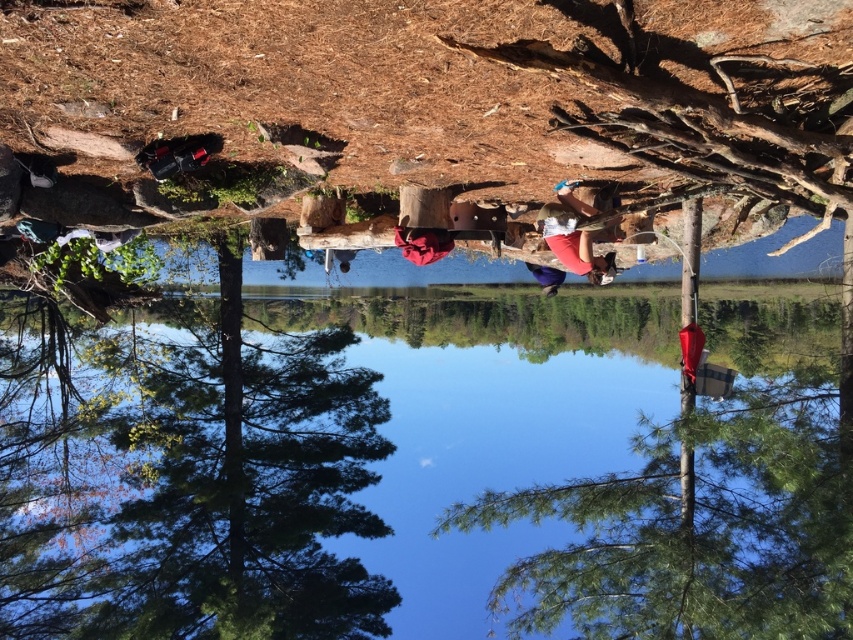
Question: Which object is closer to the camera taking this photo?

Choices:
 (A) matte red shorts at center
 (B) green leafy tree at center

Answer: (A)

Question: Can you confirm if transparent water at center is positioned above green leafy tree at center?

Choices:
 (A) no
 (B) yes

Answer: (A)

Question: Does transparent water at center appear over matte red shorts at center?

Choices:
 (A) no
 (B) yes

Answer: (A)

Question: Does green leafy tree at center appear under matte red shorts at center?

Choices:
 (A) yes
 (B) no

Answer: (A)

Question: Which object is positioned farthest from the matte red shorts at center?

Choices:
 (A) green leafy tree at center
 (B) transparent water at center

Answer: (B)

Question: Which point is closer to the camera?

Choices:
 (A) (567, 266)
 (B) (517, 609)
 (C) (450, 413)

Answer: (A)